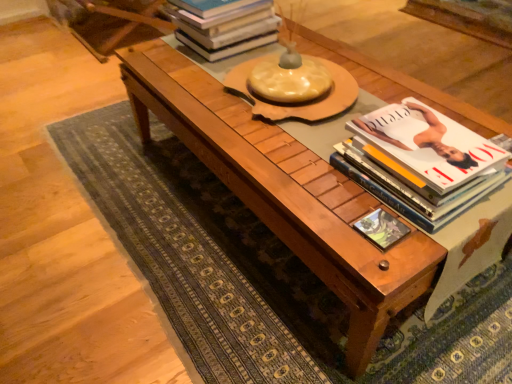
Find the location of `unoccupied space behind white glossy book at right, which is the 1th book from bottom to top`. unoccupied space behind white glossy book at right, which is the 1th book from bottom to top is located at coordinates point(385,106).